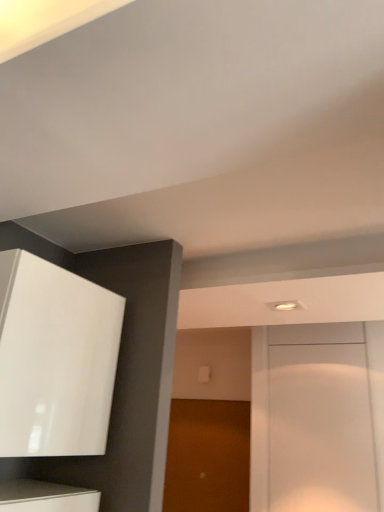
Where is `free space above white glossy door at center, which ranks as the second door in back-to-front order (from a real-world perspective)`? This screenshot has height=512, width=384. free space above white glossy door at center, which ranks as the second door in back-to-front order (from a real-world perspective) is located at coordinates (313, 344).